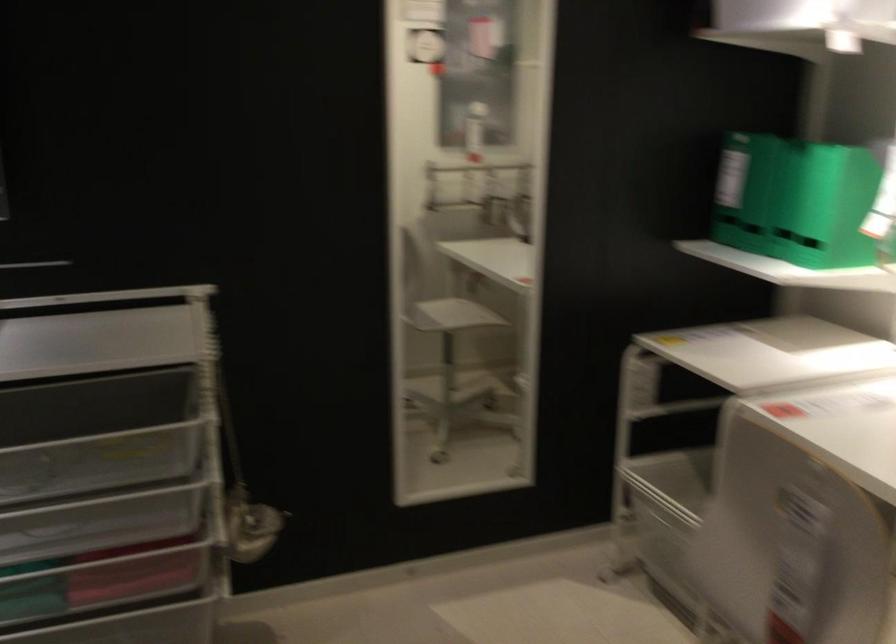
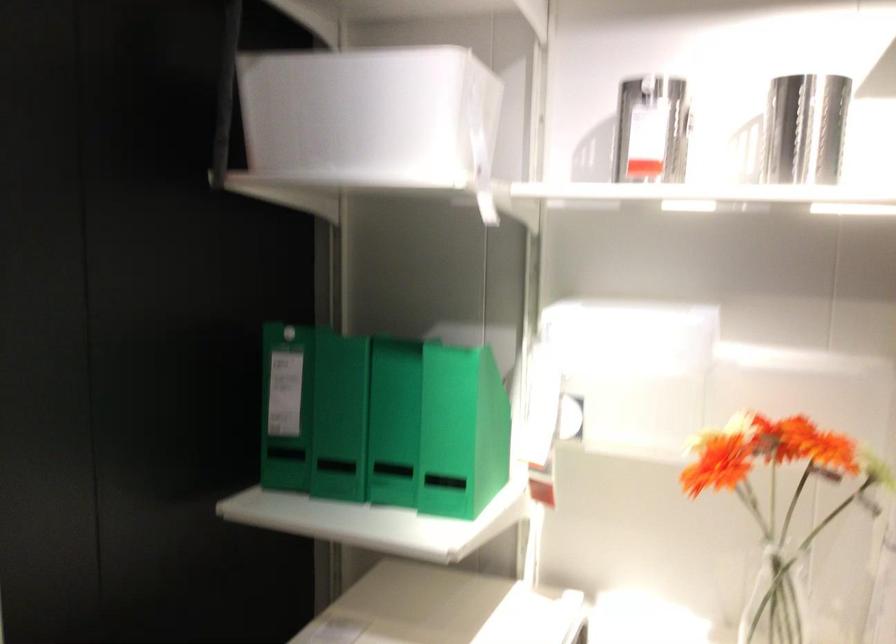
Find the pixel in the second image that matches (746,194) in the first image.

(339, 417)